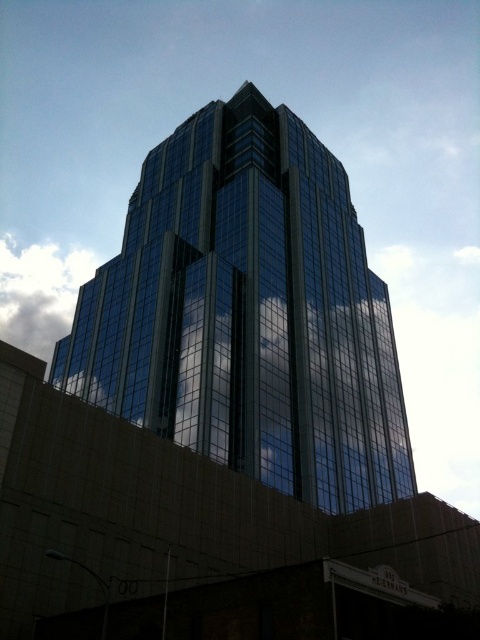
Looking at this image, does glossy glass building at center appear on the right side of white fluffy cloud at upper left?

Yes, glossy glass building at center is to the right of white fluffy cloud at upper left.

Can you confirm if glossy glass building at center is thinner than white fluffy cloud at upper left?

Yes, glossy glass building at center is thinner than white fluffy cloud at upper left.

Which is behind, point (279, 264) or point (62, 266)?

Point (62, 266)

The image size is (480, 640). Find the location of `glossy glass building at center`. glossy glass building at center is located at coordinates (249, 314).